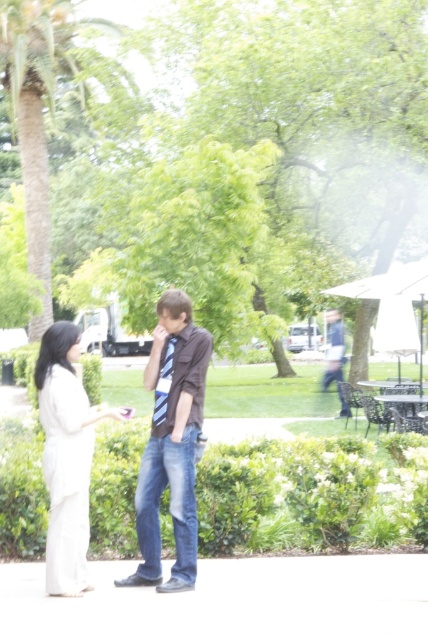
Question: Which of the following is the farthest from the observer?

Choices:
 (A) dark brown shirt at center
 (B) green leafy palm tree at left

Answer: (B)

Question: Which object is positioned farthest from the green leafy palm tree at left?

Choices:
 (A) dark brown shirt at center
 (B) blue jeans at center
 (C) white matte dress at left

Answer: (C)

Question: Is dark brown shirt at center below white matte dress at left?

Choices:
 (A) no
 (B) yes

Answer: (A)

Question: Can you confirm if white matte dress at left is smaller than blue jeans at center?

Choices:
 (A) yes
 (B) no

Answer: (A)

Question: Is green leafy palm tree at left thinner than blue jeans at center?

Choices:
 (A) yes
 (B) no

Answer: (B)

Question: Which of the following is the closest to the observer?

Choices:
 (A) white matte dress at left
 (B) green leafy palm tree at left
 (C) dark brown shirt at center
 (D) blue jeans at center

Answer: (A)